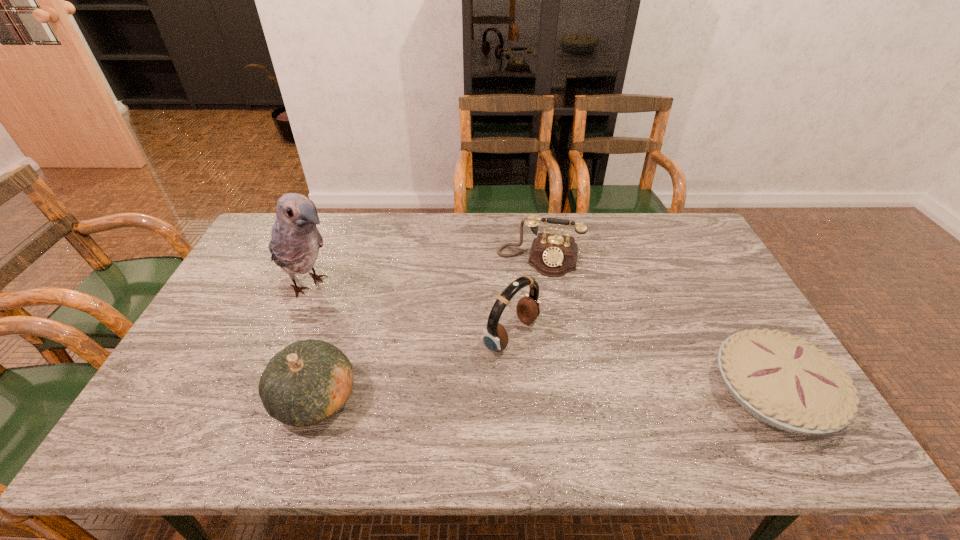
Identify the location of vacant space located 0.240m on the dial of the telephone. The image size is (960, 540). (522, 333).

Identify the location of free space located on the front-facing side of the parrot. (360, 313).

Where is `vacant area situated on the front-facing side of the parrot`? The height and width of the screenshot is (540, 960). vacant area situated on the front-facing side of the parrot is located at coordinates [363, 314].

I want to click on blank area located 0.180m on the front-facing side of the parrot, so click(379, 325).

Locate an element on the screen. free space located on the ear cup of the headset is located at coordinates click(x=609, y=399).

Find the location of a particular element. This screenshot has height=540, width=960. vacant space located 0.250m on the ear cup of the headset is located at coordinates (619, 406).

Locate an element on the screen. The image size is (960, 540). free location located on the ear cup of the headset is located at coordinates (597, 392).

Image resolution: width=960 pixels, height=540 pixels. In order to click on object located at the far edge in this screenshot , I will do `click(553, 255)`.

I want to click on gourd at the near edge, so click(308, 382).

Where is `pie at the near edge`? The width and height of the screenshot is (960, 540). pie at the near edge is located at coordinates (785, 382).